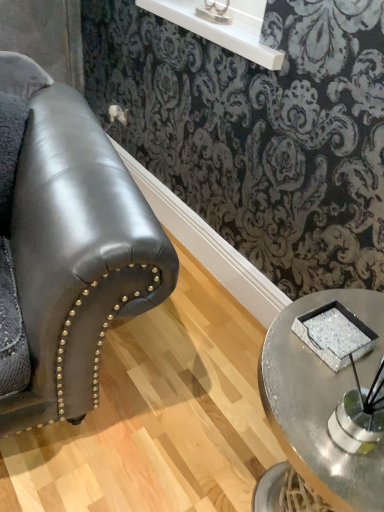
The height and width of the screenshot is (512, 384). In order to click on free space in front of sparkly silver tray at center in this screenshot , I will do `click(316, 410)`.